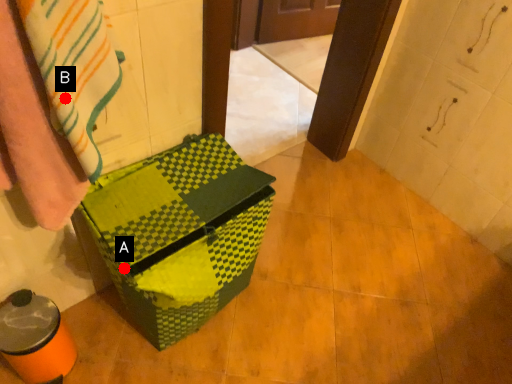
Question: Two points are circled on the image, labeled by A and B beside each circle. Which point is farther to the camera?

Choices:
 (A) A is further
 (B) B is further

Answer: (A)